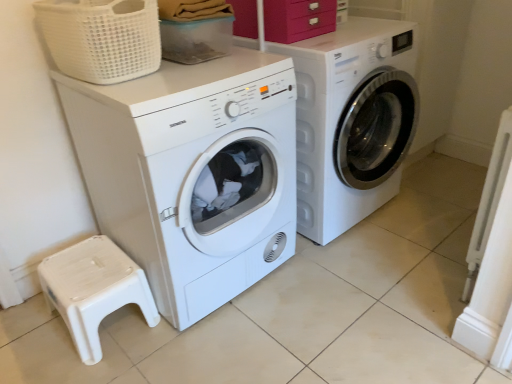
Identify the location of vacant area that lies between white glossy washing machine at center, the first washing machine positioned from the right, and white matte washing machine at left, the 2th washing machine positioned from the right. (282, 288).